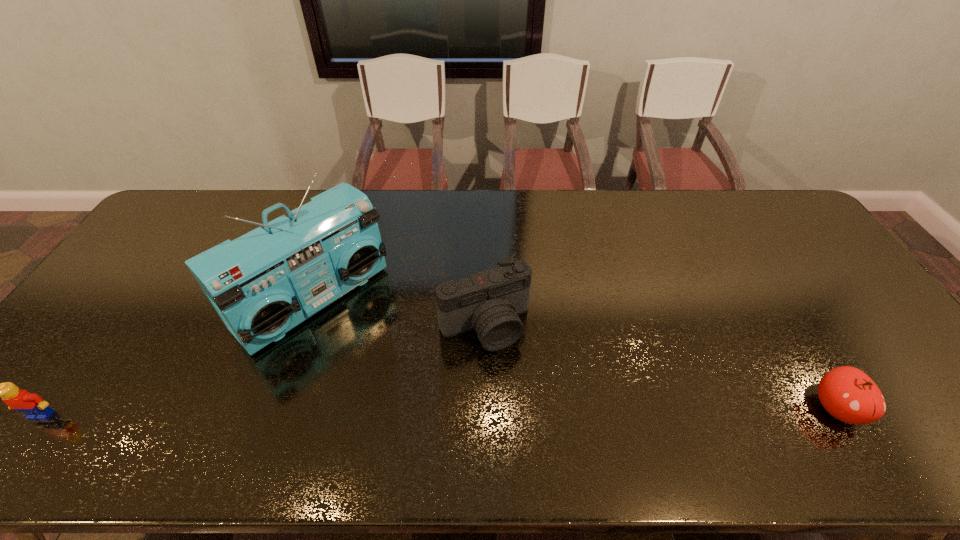
Identify the location of free space that is in between the Lego and the camera. (263, 370).

Where is `free area in between the rightmost object and the camera`? This screenshot has width=960, height=540. free area in between the rightmost object and the camera is located at coordinates (660, 367).

This screenshot has width=960, height=540. Find the location of `the third closest object to the Lego`. the third closest object to the Lego is located at coordinates (848, 394).

The width and height of the screenshot is (960, 540). I want to click on the closest object to the rightmost object, so click(489, 302).